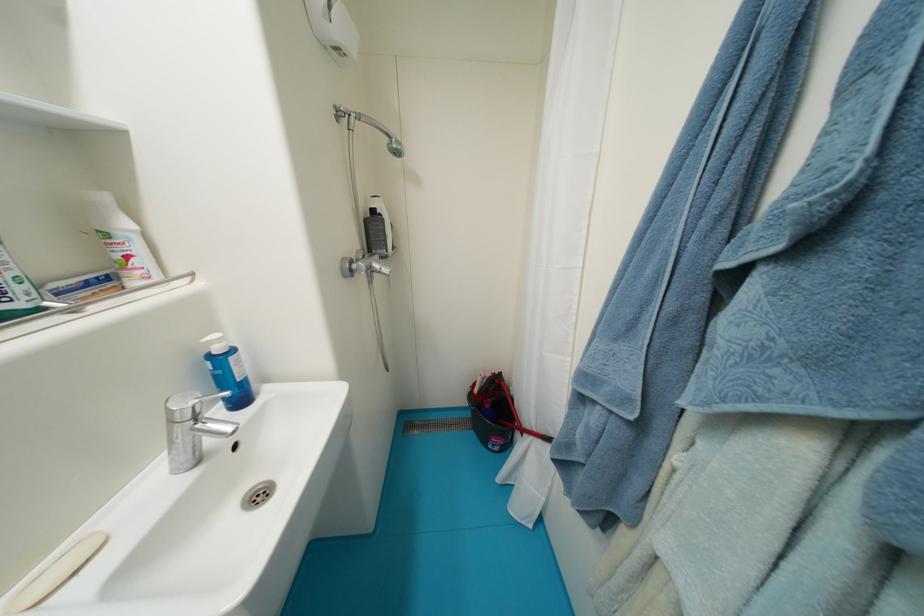
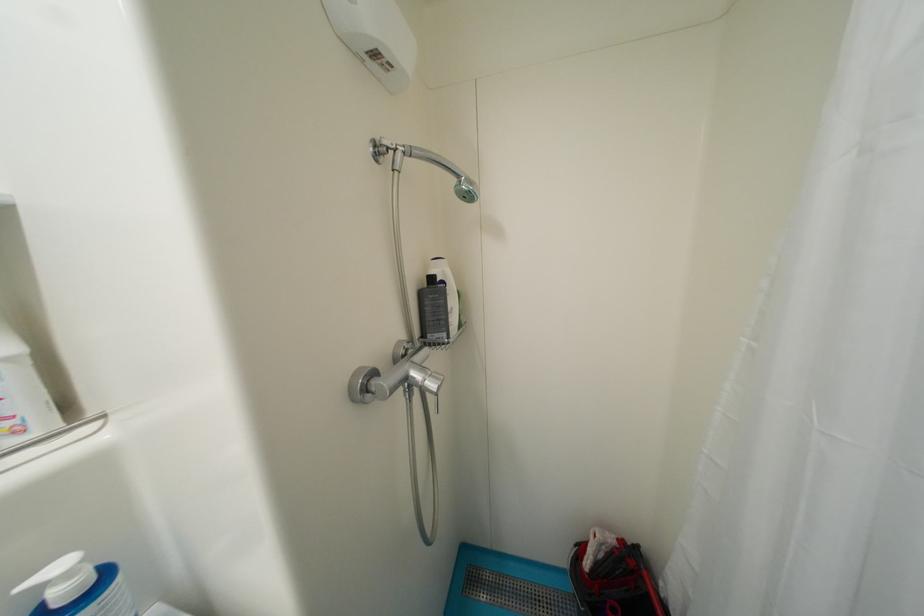
Find the pixel in the second image that matches point (357, 267) in the first image.

(374, 383)